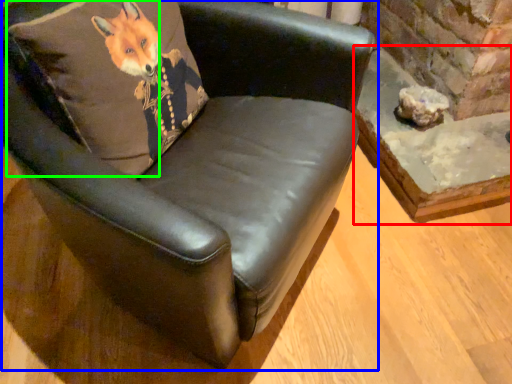
Question: Estimate the real-world distances between objects in this image. Which object is farther from table (highlighted by a red box), chair (highlighted by a blue box) or pillow (highlighted by a green box)?

Choices:
 (A) chair
 (B) pillow

Answer: (B)